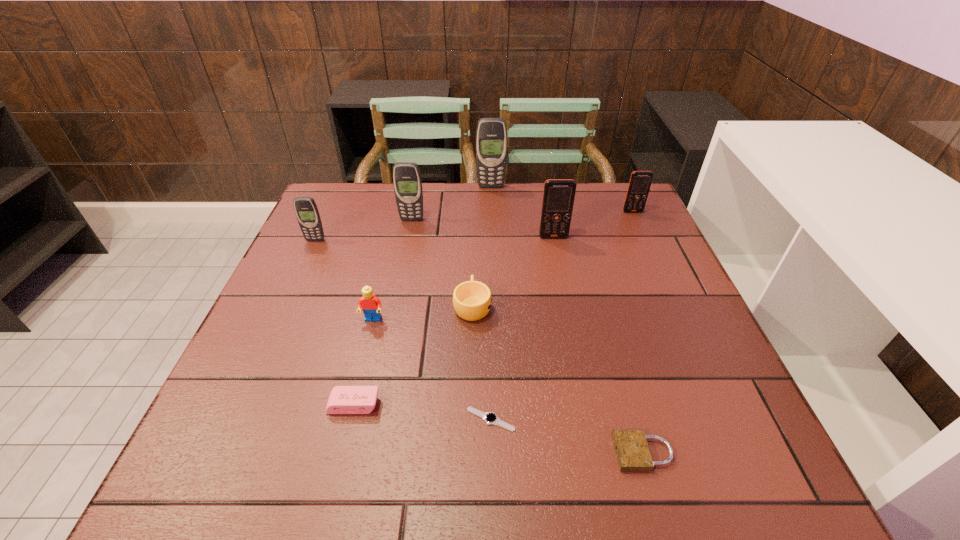
In order to click on free spot at the far right corner of the desktop in this screenshot , I will do `click(597, 212)`.

The width and height of the screenshot is (960, 540). I want to click on free space that is in between the fifth shortest object and the nearest object, so click(508, 386).

You are a GUI agent. You are given a task and a screenshot of the screen. Output one action in this format:
    pyautogui.click(x=<x>, y=<y>)
    Task: Click on the vacant space that is in between the eighth tallest object and the rightmost cellular telephone
    
    Given the screenshot: What is the action you would take?
    pyautogui.click(x=493, y=308)

The height and width of the screenshot is (540, 960). I want to click on vacant point located between the red Lego and the biggest gray cellular telephone, so click(432, 253).

Identify the location of free space between the Lego and the fourth shortest object. (422, 313).

At what (x,y) coordinates should I click in order to perform the action: click on unoccupied position between the padlock and the watch. Please return your answer as a coordinate pair (x, y). The width and height of the screenshot is (960, 540). Looking at the image, I should click on (567, 436).

I want to click on vacant point located between the right orange cellular telephone and the third shortest object, so click(x=493, y=308).

This screenshot has height=540, width=960. I want to click on empty space that is in between the third shortest object and the beige cup, so click(x=413, y=355).

Find the location of a particular element. The height and width of the screenshot is (540, 960). empty location between the right orange cellular telephone and the padlock is located at coordinates (637, 332).

Identify the location of vacant space in between the farthest cellular telephone and the nearer orange cellular telephone. (522, 212).